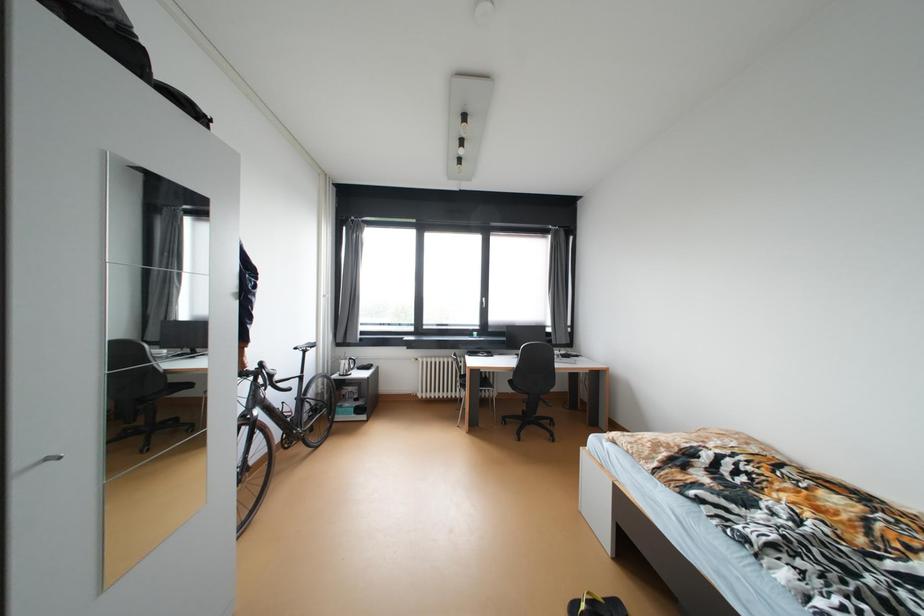
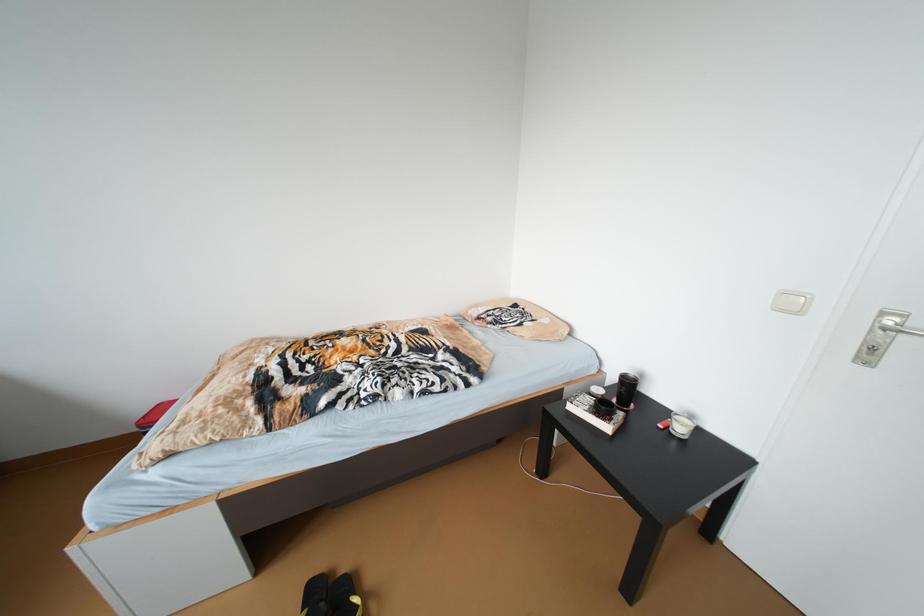
How did the camera likely rotate?

The camera rotated toward right-down.